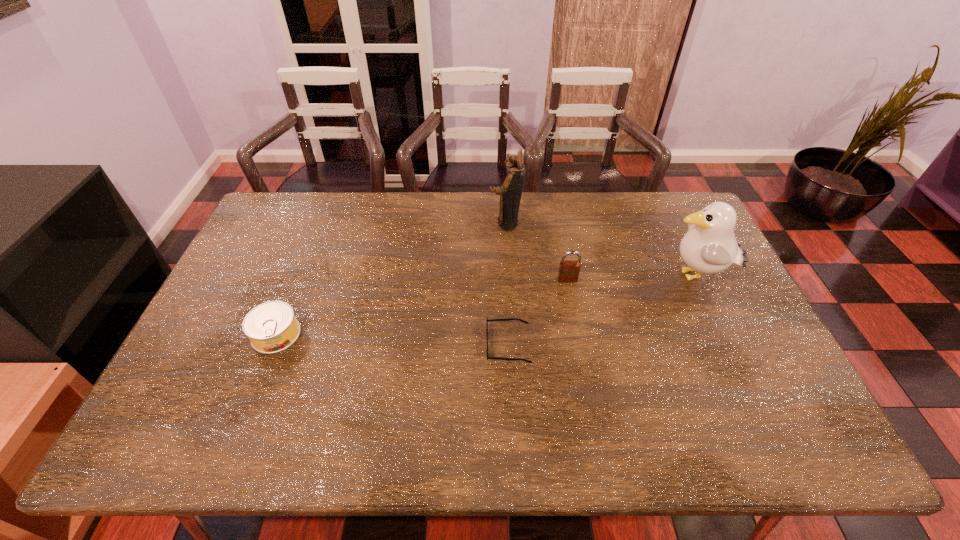
The image size is (960, 540). I want to click on object that is at the right edge, so click(709, 246).

This screenshot has width=960, height=540. What are the coordinates of `free spot at the far edge of the desktop` in the screenshot? It's located at (324, 227).

Identify the location of vacant area at the near edge of the desktop. (735, 436).

You are a GUI agent. You are given a task and a screenshot of the screen. Output one action in this format:
    pyautogui.click(x=<x>, y=<y>)
    Task: Click on the free space at the left edge
    
    Given the screenshot: What is the action you would take?
    pyautogui.click(x=210, y=414)

The height and width of the screenshot is (540, 960). In the image, there is a desktop. Find the location of `vacant space at the right edge`. vacant space at the right edge is located at coordinates (733, 405).

Image resolution: width=960 pixels, height=540 pixels. I want to click on unoccupied area between the leftmost object and the fourth object from left to right, so click(x=421, y=307).

At what (x,y) coordinates should I click in order to perform the action: click on vacant region between the padlock and the shortest object. Please return your answer as a coordinate pair (x, y). The height and width of the screenshot is (540, 960). Looking at the image, I should click on (538, 312).

Where is `free space between the farthest object and the rightmost object`? free space between the farthest object and the rightmost object is located at coordinates click(600, 250).

Image resolution: width=960 pixels, height=540 pixels. I want to click on free spot between the can and the shortest object, so click(393, 340).

Locate an element on the screen. This screenshot has height=540, width=960. vacant region between the rightmost object and the leftmost object is located at coordinates (486, 306).